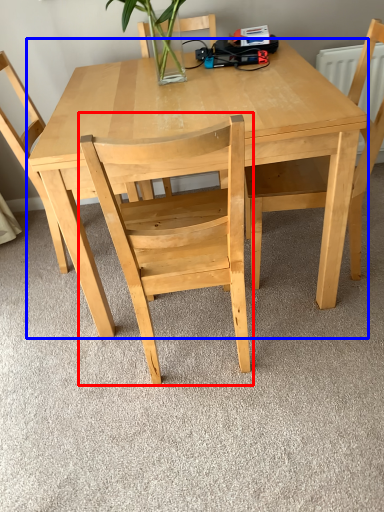
Question: Which object is further to the camera taking this photo, chair (highlighted by a red box) or table (highlighted by a blue box)?

Choices:
 (A) chair
 (B) table

Answer: (B)